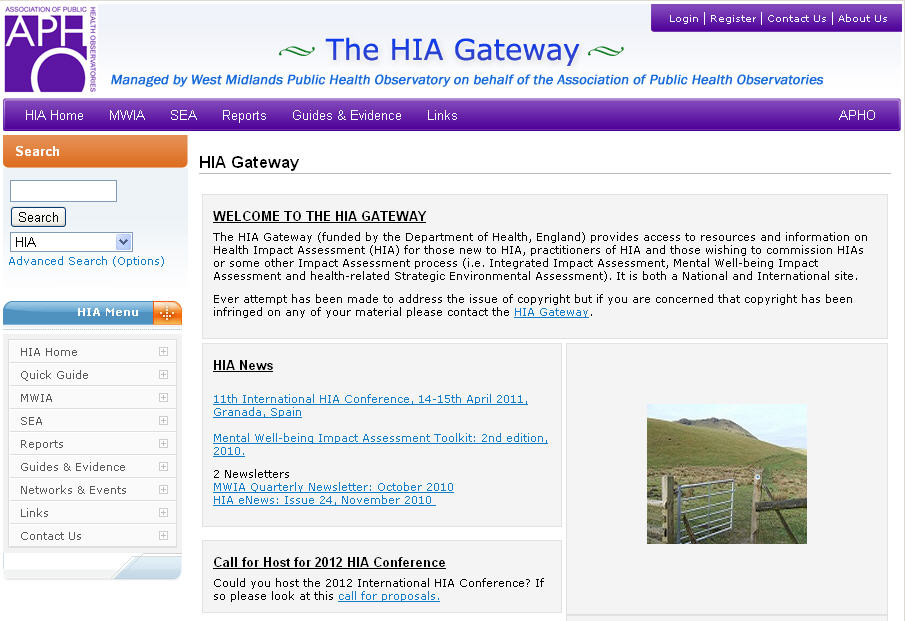
Where is `register`? The image size is (905, 621). register is located at coordinates (724, 20).